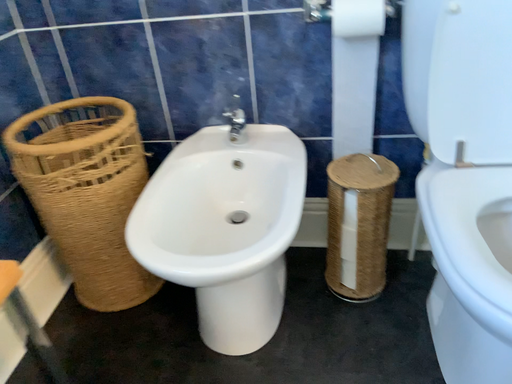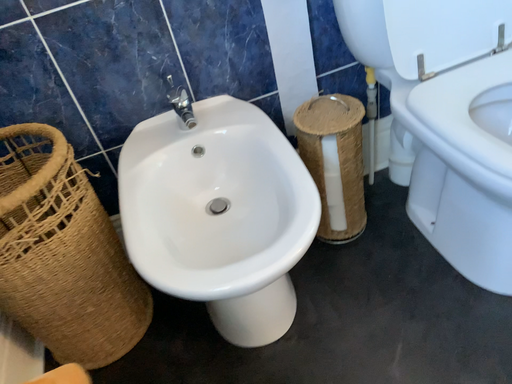
Question: Which way did the camera rotate in the video?

Choices:
 (A) rotated right
 (B) rotated left

Answer: (A)